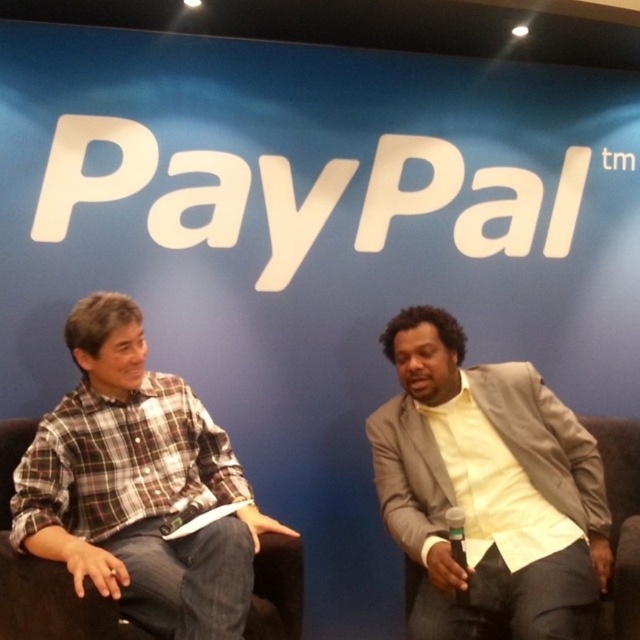
Based on the scene description, can you determine the spatial arrangement of the two individuals wearing the light beige textured blazer at right and the plaid cotton shirt at left? Specifically, which one is positioned to the east of the other?

The light beige textured blazer at right is positioned to the east of the plaid cotton shirt at left because the person wearing it is on the right side of the image, which typically corresponds to the east direction in such staged settings.

You are an event organizer who needs to ensure that all participants have enough space on the stage. The plaid cotton shirt at left and the light beige textured blazer at right are seated next to each other. Based on their clothing, which person might require more space due to the thickness of their garment?

The plaid cotton shirt at left requires more space because the plaid cotton shirt at left is thicker than the light beige textured blazer at right.

Based on the scene description, which object is located at the coordinates point (488, 484)?

The point (488, 484) corresponds to the light beige textured blazer at right.